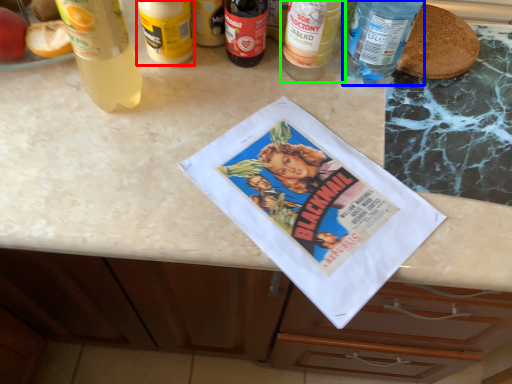
Question: Considering the real-world distances, which object is farthest from bottle (highlighted by a red box)? bottle (highlighted by a blue box) or bottle (highlighted by a green box)?

Choices:
 (A) bottle
 (B) bottle

Answer: (A)